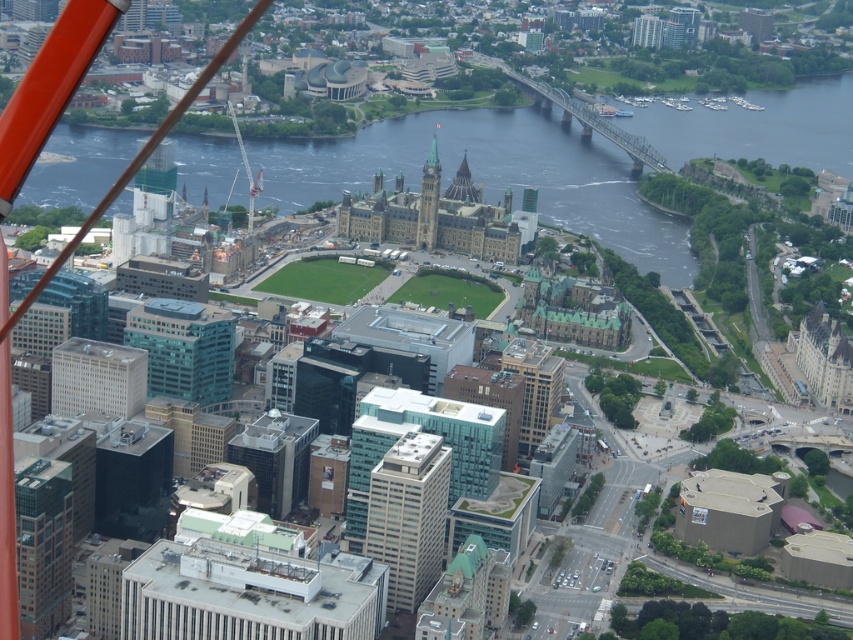
Question: Which point is closer to the camera?

Choices:
 (A) (273, 460)
 (B) (532, 394)
 (C) (219, 339)

Answer: (B)

Question: Estimate the real-world distances between objects in this image. Which object is farther from the green glass skyscraper at lower left?

Choices:
 (A) glassy teal skyscraper at center-left
 (B) beige concrete building at center
 (C) white smooth building at center-left

Answer: (B)

Question: Can you confirm if glassy teal skyscraper at center-left is bigger than gold glass skyscraper at center?

Choices:
 (A) yes
 (B) no

Answer: (A)

Question: Can you confirm if gold glass skyscraper at center is positioned below green stone clock tower at center?

Choices:
 (A) yes
 (B) no

Answer: (A)

Question: Does dark blue water at center appear on the right side of beige concrete building at center?

Choices:
 (A) yes
 (B) no

Answer: (A)

Question: Which object is farther from the camera taking this photo?

Choices:
 (A) green glass skyscraper at lower left
 (B) glassy teal skyscraper at center-left
 (C) gold glass skyscraper at center

Answer: (A)